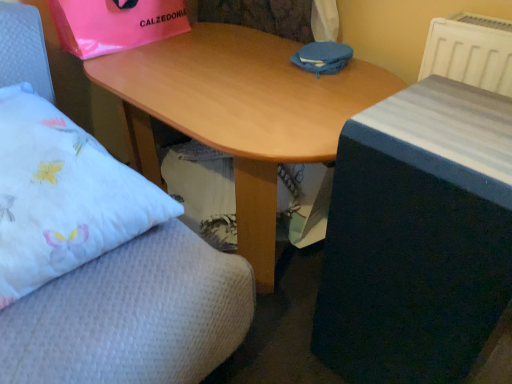
Question: From the image's perspective, is wooden table at center located above or below white plastic radiator at upper right?

Choices:
 (A) below
 (B) above

Answer: (A)

Question: Is wooden table at center bigger or smaller than white plastic radiator at upper right?

Choices:
 (A) small
 (B) big

Answer: (B)

Question: Which object is the closest to the wooden desk at center?

Choices:
 (A) wooden table at center
 (B) pink plastic bag at upper left
 (C) white plastic radiator at upper right
 (D) white fabric pillow at left

Answer: (B)

Question: Which object is the closest to the wooden table at center?

Choices:
 (A) pink plastic bag at upper left
 (B) white fabric pillow at left
 (C) white plastic radiator at upper right
 (D) wooden desk at center

Answer: (D)